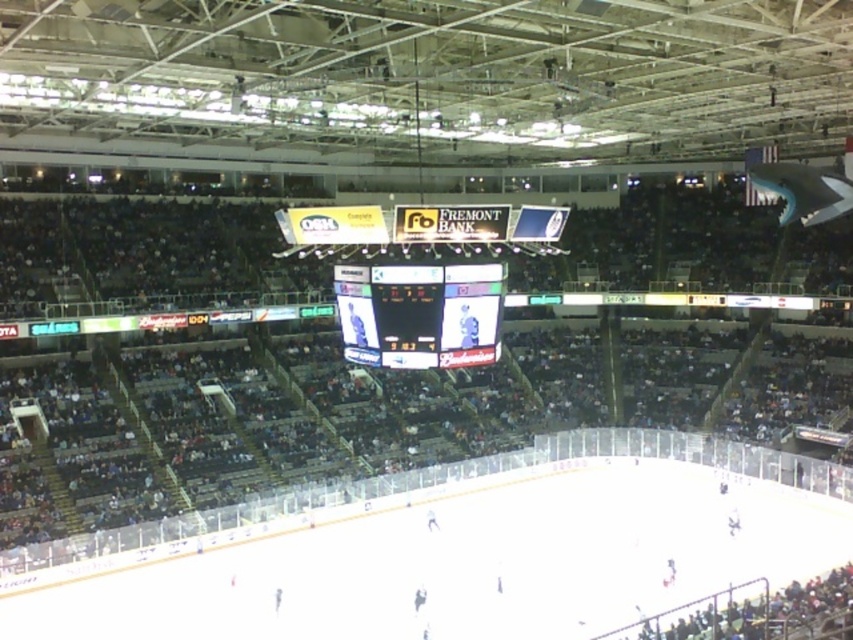
Who is more distant from viewer, (x=624, y=490) or (x=401, y=291)?

The point (x=624, y=490) is more distant.

Based on the photo, is white smooth ice at center shorter than black glossy scoreboard at center?

Incorrect, white smooth ice at center's height does not fall short of black glossy scoreboard at center's.

Locate an element on the screen. The height and width of the screenshot is (640, 853). white smooth ice at center is located at coordinates (454, 561).

Find the location of `white smooth ice at center`. white smooth ice at center is located at coordinates (454, 561).